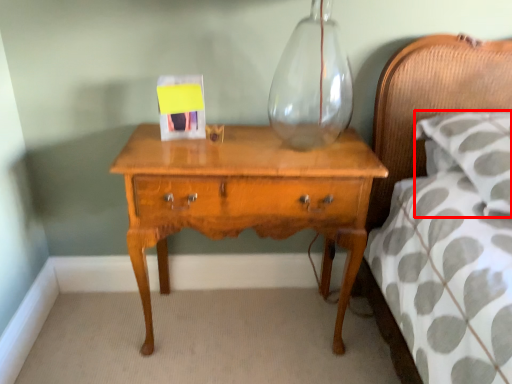
Question: From the image's perspective, what is the correct spatial positioning of pillow (annotated by the red box) in reference to nightstand?

Choices:
 (A) above
 (B) below

Answer: (A)